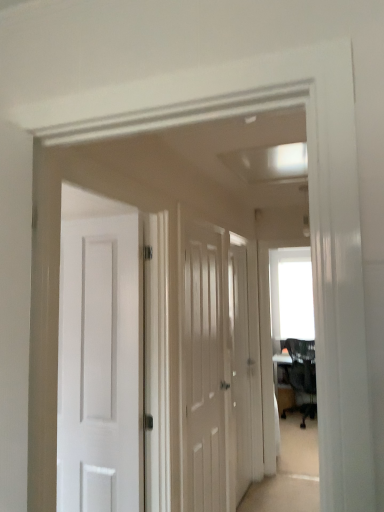
Question: Considering the positions of white wood door at center, which ranks as the 1th door in front-to-back order, and white wooden door at center, the second door viewed from the front, in the image, is white wood door at center, which ranks as the 1th door in front-to-back order, wider or thinner than white wooden door at center, the second door viewed from the front,?

Choices:
 (A) thin
 (B) wide

Answer: (B)

Question: From a real-world perspective, is white wood door at center, which appears as the first door when viewed from the left, above or below white wooden door at center, the second door viewed from the left?

Choices:
 (A) below
 (B) above

Answer: (B)

Question: Estimate the real-world distances between objects in this image. Which object is farther from the white wood door at center, the 2th door from the back?

Choices:
 (A) white wooden door at center, placed as the 1th door when sorted from back to front
 (B) black mesh chair at right

Answer: (B)

Question: Which object is the farthest from the black mesh chair at right?

Choices:
 (A) white wooden door at center, the second door viewed from the left
 (B) white wood door at center, which ranks as the 1th door in front-to-back order

Answer: (B)